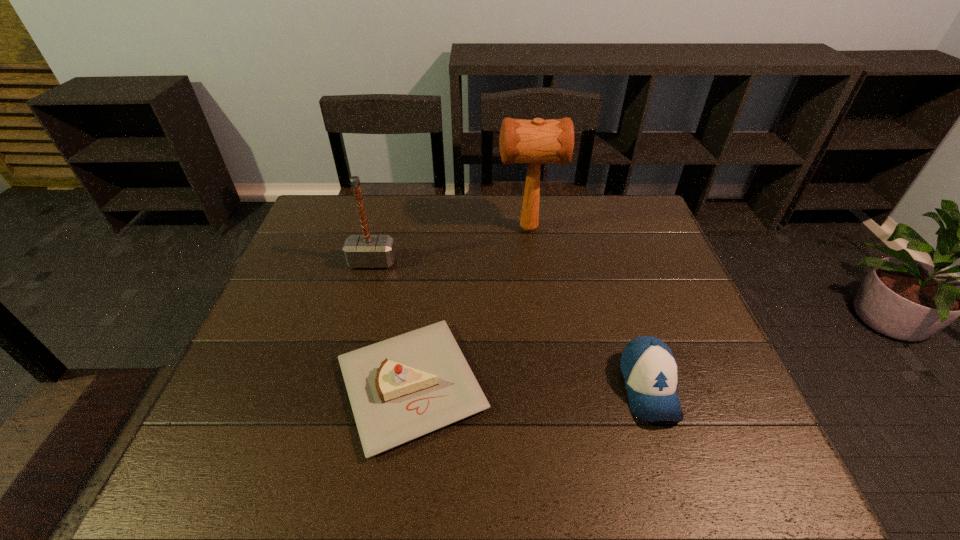
Locate an element on the screen. the tallest object is located at coordinates (536, 141).

Identify the location of the farthest object. The image size is (960, 540). (536, 141).

In order to click on the second tallest object in this screenshot , I will do `click(360, 251)`.

The height and width of the screenshot is (540, 960). I want to click on hammer, so click(x=360, y=251).

Locate an element on the screen. The width and height of the screenshot is (960, 540). the rightmost object is located at coordinates (649, 369).

The width and height of the screenshot is (960, 540). Find the location of `baseball cap`. baseball cap is located at coordinates (649, 369).

Locate an element on the screen. This screenshot has width=960, height=540. cake is located at coordinates (402, 388).

Where is `blank area located on the strike surface of the farthest object`? The width and height of the screenshot is (960, 540). blank area located on the strike surface of the farthest object is located at coordinates (372, 228).

Where is `free point located on the strike surface of the farthest object`? This screenshot has width=960, height=540. free point located on the strike surface of the farthest object is located at coordinates (387, 228).

This screenshot has height=540, width=960. Identify the location of free space located on the strike surface of the farthest object. (399, 228).